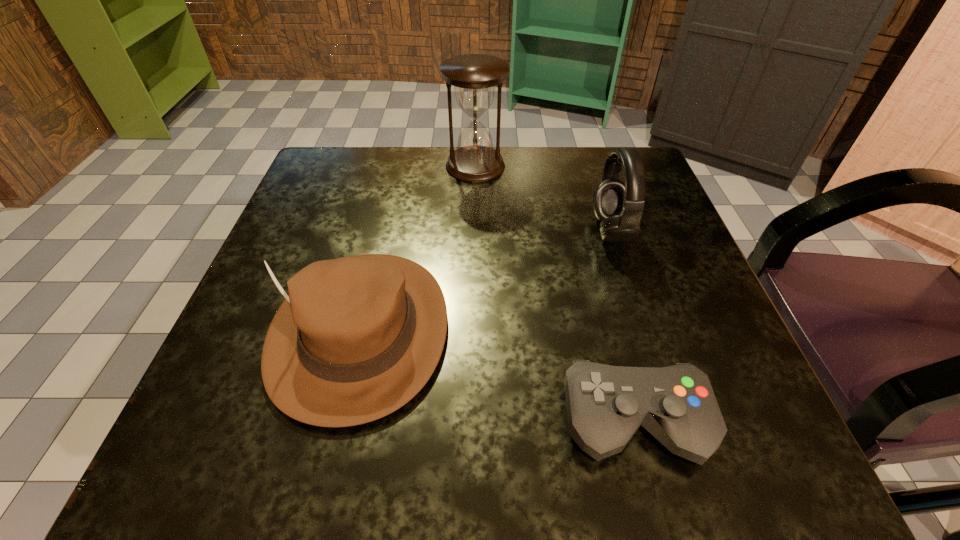
Identify the location of vacant area in the image that satisfies the following two spatial constraints: 1. on the feather side of the shortest object; 2. on the left side of the fedora. (339, 421).

Locate an element on the screen. The height and width of the screenshot is (540, 960). vacant space that satisfies the following two spatial constraints: 1. on the feather side of the shortest object; 2. on the right side of the fedora is located at coordinates (339, 421).